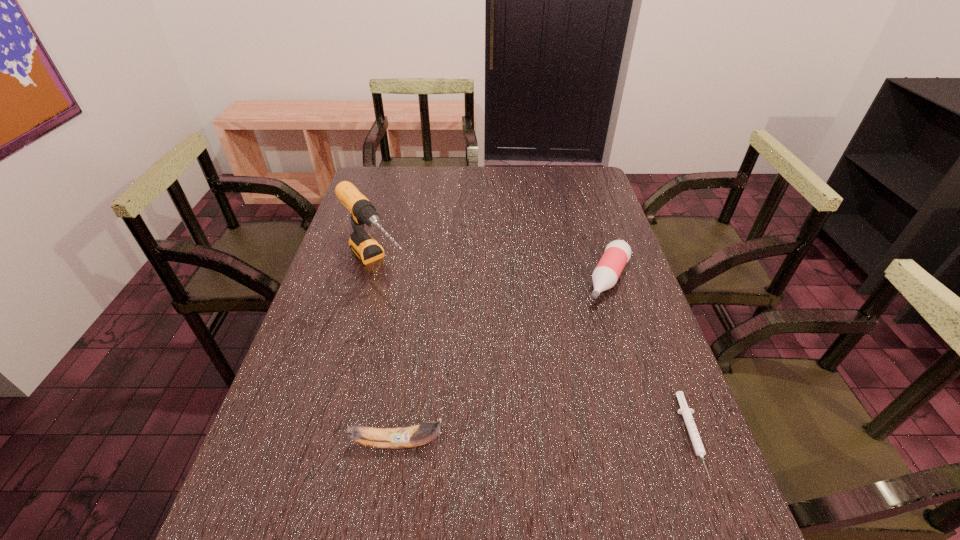
Where is `vacant region located with the cap open on the second shortest object`? The height and width of the screenshot is (540, 960). vacant region located with the cap open on the second shortest object is located at coordinates (554, 399).

At what (x,y) coordinates should I click in order to perform the action: click on free space located 0.120m with the cap open on the second shortest object. Please return your answer as a coordinate pair (x, y). The image size is (960, 540). Looking at the image, I should click on (588, 332).

I want to click on object that is at the near edge, so click(686, 412).

Where is `object at the left edge`? This screenshot has height=540, width=960. object at the left edge is located at coordinates (366, 248).

Where is `syringe present at the right edge`? The width and height of the screenshot is (960, 540). syringe present at the right edge is located at coordinates (686, 412).

The width and height of the screenshot is (960, 540). I want to click on bottle located at the right edge, so pos(617,253).

The image size is (960, 540). Find the location of `object at the near right corner`. object at the near right corner is located at coordinates (686, 412).

Identify the location of vacant space at the far edge of the desktop. This screenshot has width=960, height=540. (502, 177).

Where is `free space at the near edge of the desktop`? The width and height of the screenshot is (960, 540). free space at the near edge of the desktop is located at coordinates (402, 472).

You are a GUI agent. You are given a task and a screenshot of the screen. Output one action in this format:
    pyautogui.click(x=<x>, y=<y>)
    Task: Click on the vacant area at the left edge
    
    Given the screenshot: What is the action you would take?
    pyautogui.click(x=394, y=201)